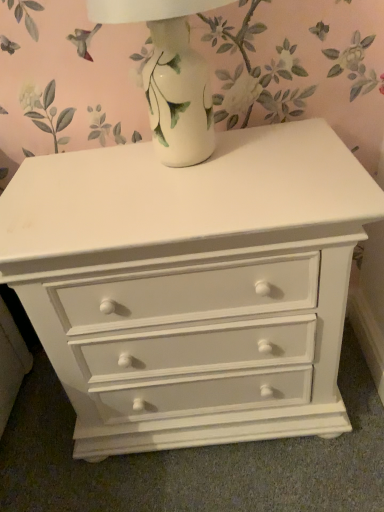
At what (x,y) coordinates should I click in order to perform the action: click on free spot to the right of white glossy vase at upper center. Please return your answer as a coordinate pair (x, y). This screenshot has height=512, width=384. Looking at the image, I should click on (296, 145).